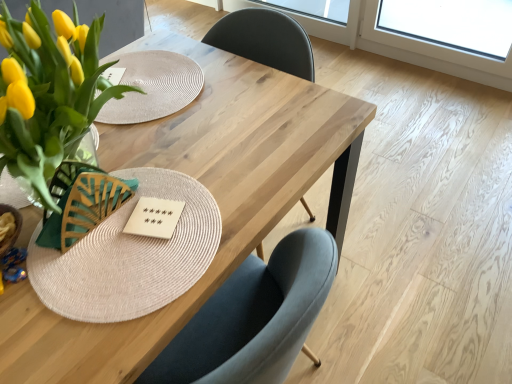
The height and width of the screenshot is (384, 512). In order to click on vacant region to the left of wooden card game at center in this screenshot , I will do `click(78, 245)`.